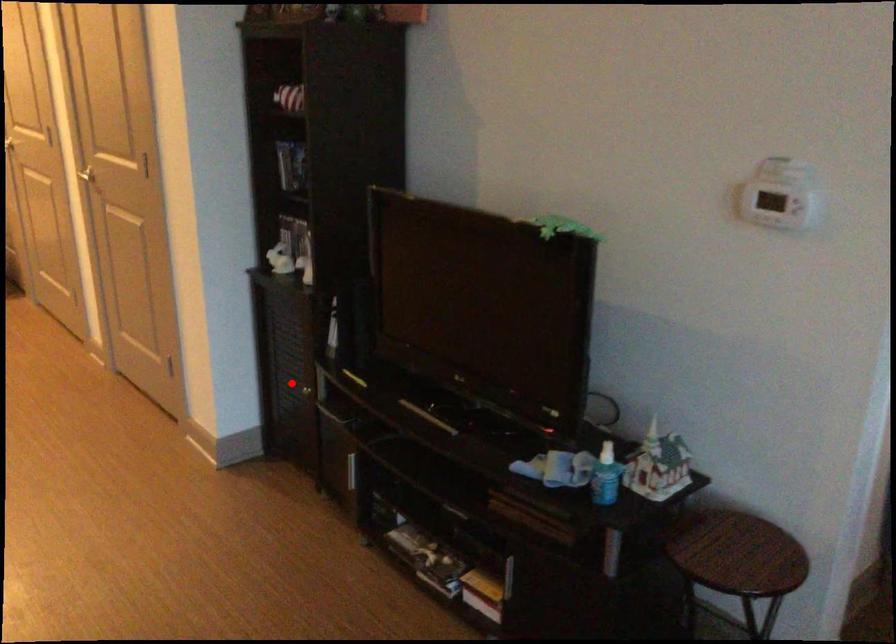
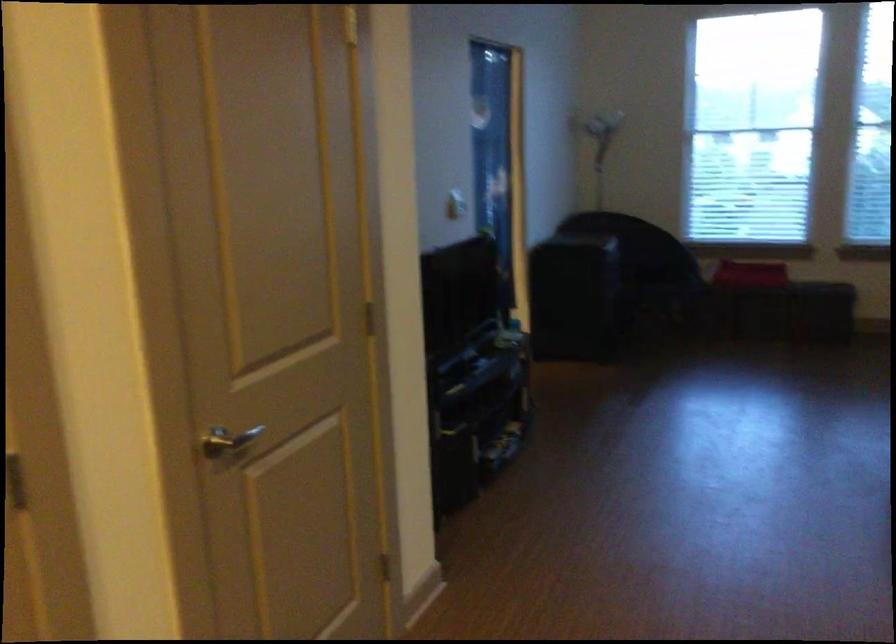
Question: I am providing you with two images of the same scene from different viewpoints. A red point is marked on the first image. Can you still see the location of the red point in image 2?

Choices:
 (A) Yes
 (B) No

Answer: (B)